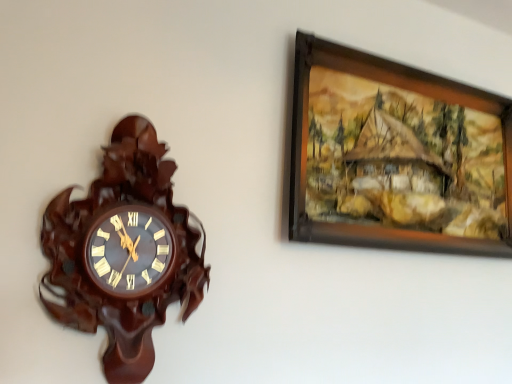
Question: Is there a large distance between brown wooden picture frame at upper right and mahogany wood wall clock at left?

Choices:
 (A) no
 (B) yes

Answer: (A)

Question: Is brown wooden picture frame at upper right next to mahogany wood wall clock at left and touching it?

Choices:
 (A) yes
 (B) no

Answer: (B)

Question: Is mahogany wood wall clock at left at the back of brown wooden picture frame at upper right?

Choices:
 (A) no
 (B) yes

Answer: (A)

Question: From the image's perspective, is brown wooden picture frame at upper right on top of mahogany wood wall clock at left?

Choices:
 (A) yes
 (B) no

Answer: (A)

Question: Is brown wooden picture frame at upper right positioned beyond the bounds of mahogany wood wall clock at left?

Choices:
 (A) no
 (B) yes

Answer: (B)

Question: Considering the relative sizes of brown wooden picture frame at upper right and mahogany wood wall clock at left in the image provided, is brown wooden picture frame at upper right shorter than mahogany wood wall clock at left?

Choices:
 (A) no
 (B) yes

Answer: (B)

Question: Can you confirm if mahogany wood wall clock at left is positioned to the right of brown wooden picture frame at upper right?

Choices:
 (A) yes
 (B) no

Answer: (B)

Question: Is mahogany wood wall clock at left positioned before brown wooden picture frame at upper right?

Choices:
 (A) no
 (B) yes

Answer: (B)

Question: Is mahogany wood wall clock at left touching brown wooden picture frame at upper right?

Choices:
 (A) no
 (B) yes

Answer: (A)

Question: Is mahogany wood wall clock at left far from brown wooden picture frame at upper right?

Choices:
 (A) no
 (B) yes

Answer: (A)

Question: Can you confirm if mahogany wood wall clock at left is taller than brown wooden picture frame at upper right?

Choices:
 (A) no
 (B) yes

Answer: (B)

Question: From the image's perspective, is mahogany wood wall clock at left on brown wooden picture frame at upper right?

Choices:
 (A) yes
 (B) no

Answer: (B)

Question: Is mahogany wood wall clock at left spatially inside brown wooden picture frame at upper right, or outside of it?

Choices:
 (A) inside
 (B) outside

Answer: (B)